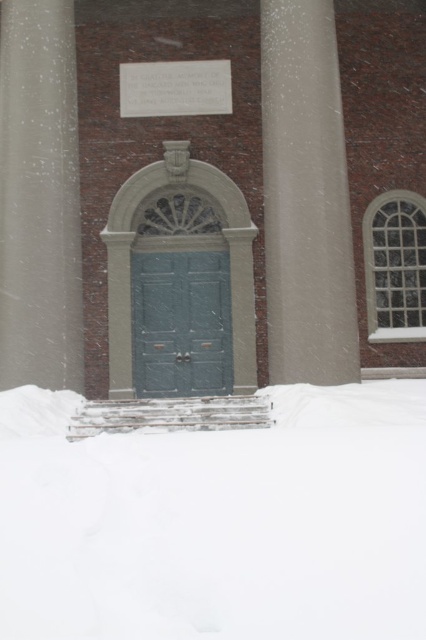
Does smooth concrete pillar at right appear over smooth concrete pillar at left?

No, smooth concrete pillar at right is not above smooth concrete pillar at left.

Between smooth concrete pillar at right and smooth concrete pillar at left, which one has more height?

smooth concrete pillar at left

The image size is (426, 640). What do you see at coordinates (305, 198) in the screenshot?
I see `smooth concrete pillar at right` at bounding box center [305, 198].

Locate an element on the screen. The width and height of the screenshot is (426, 640). smooth concrete pillar at right is located at coordinates (305, 198).

Is smooth concrete pillar at right to the right of green matte door at center from the viewer's perspective?

Yes, smooth concrete pillar at right is to the right of green matte door at center.

Between smooth concrete pillar at right and green matte door at center, which one has less height?

With less height is green matte door at center.

Does point (328, 340) come farther from viewer compared to point (172, 268)?

That is False.

Find the location of a particular element. smooth concrete pillar at right is located at coordinates (305, 198).

Who is positioned more to the left, smooth concrete pillar at left or green matte door at center?

smooth concrete pillar at left is more to the left.

Is the position of smooth concrete pillar at left less distant than that of green matte door at center?

Yes, it is.

Is point (57, 328) positioned before point (195, 355)?

Yes, it is in front of point (195, 355).

Find the location of `smooth concrete pillar at left`. smooth concrete pillar at left is located at coordinates (39, 196).